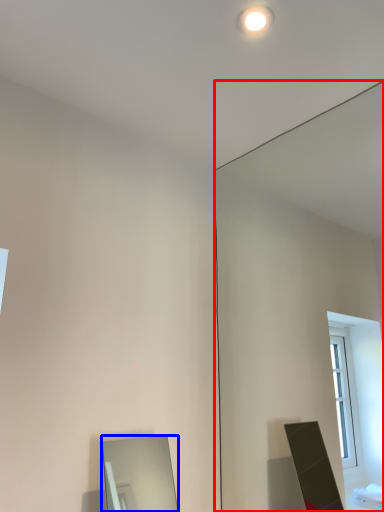
Question: Which of the following is the closest to the observer, mirror (highlighted by a red box) or mirror (highlighted by a blue box)?

Choices:
 (A) mirror
 (B) mirror

Answer: (A)